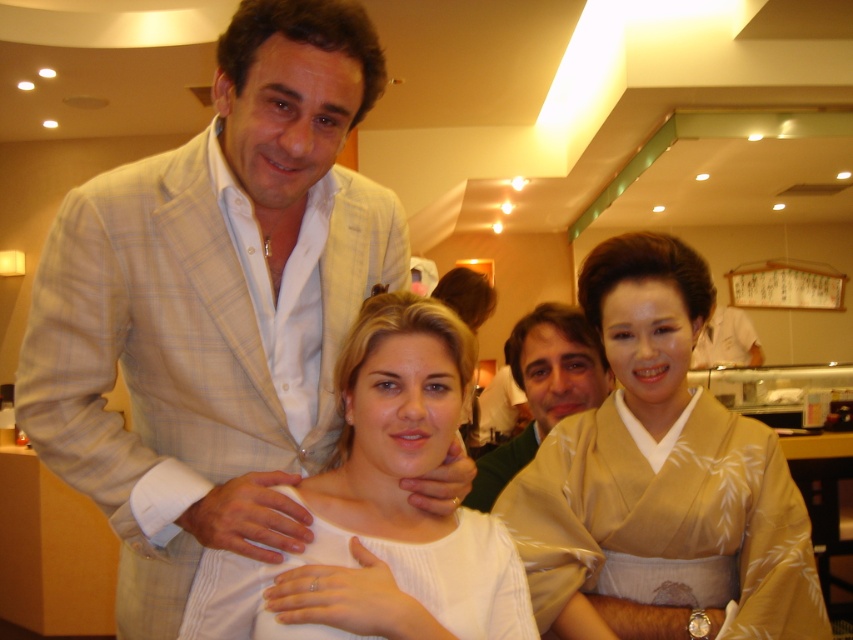
From the picture: Between beige silk kimono at center and white ribbed sweater at center, which one appears on the right side from the viewer's perspective?

Positioned to the right is beige silk kimono at center.

The width and height of the screenshot is (853, 640). I want to click on beige silk kimono at center, so click(660, 472).

Is the position of white ribbed sweater at center more distant than that of white ribbed dress at center?

No, white ribbed sweater at center is closer to the viewer.

The height and width of the screenshot is (640, 853). In order to click on white ribbed sweater at center in this screenshot , I will do [x=386, y=492].

Is point (480, 570) less distant than point (381, 605)?

No, (480, 570) is behind (381, 605).

Locate an element on the screen. This screenshot has width=853, height=640. white ribbed sweater at center is located at coordinates (386, 492).

At what (x,y) coordinates should I click in order to perform the action: click on light beige plaid suit at left. Please return your answer as a coordinate pair (x, y). The width and height of the screenshot is (853, 640). Looking at the image, I should click on (178, 349).

Which is behind, point (154, 305) or point (469, 496)?

The point (469, 496) is more distant.

Describe the element at coordinates (178, 349) in the screenshot. I see `light beige plaid suit at left` at that location.

Find the location of a particular element. light beige plaid suit at left is located at coordinates (178, 349).